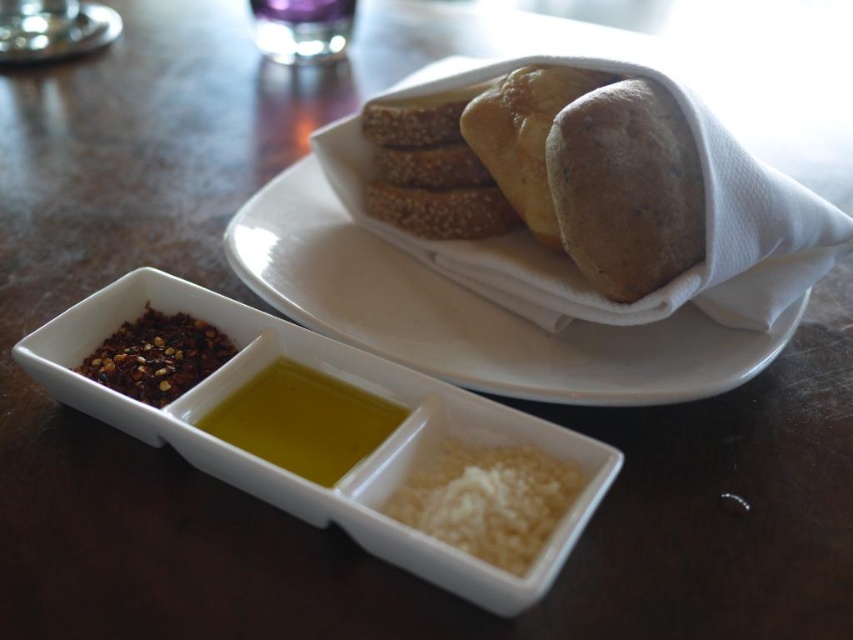
Question: Which point is farther to the camera?

Choices:
 (A) dark red spice at left
 (B) white crumbly cheese at lower center
 (C) yellow liquid oil at lower center

Answer: (A)

Question: Observing the image, what is the correct spatial positioning of white crumbly cheese at lower center in reference to yellow liquid oil at center?

Choices:
 (A) below
 (B) above

Answer: (A)

Question: Can you confirm if yellow liquid oil at center is bigger than dark red spice at left?

Choices:
 (A) yes
 (B) no

Answer: (A)

Question: Which point is farther from the camera taking this photo?

Choices:
 (A) (459, 461)
 (B) (88, 387)
 (C) (254, 442)
 (D) (631, 88)

Answer: (D)

Question: Among these points, which one is nearest to the camera?

Choices:
 (A) (618, 257)
 (B) (491, 502)

Answer: (B)

Question: Is yellow liquid oil at lower center to the left of yellow liquid oil at center from the viewer's perspective?

Choices:
 (A) yes
 (B) no

Answer: (B)